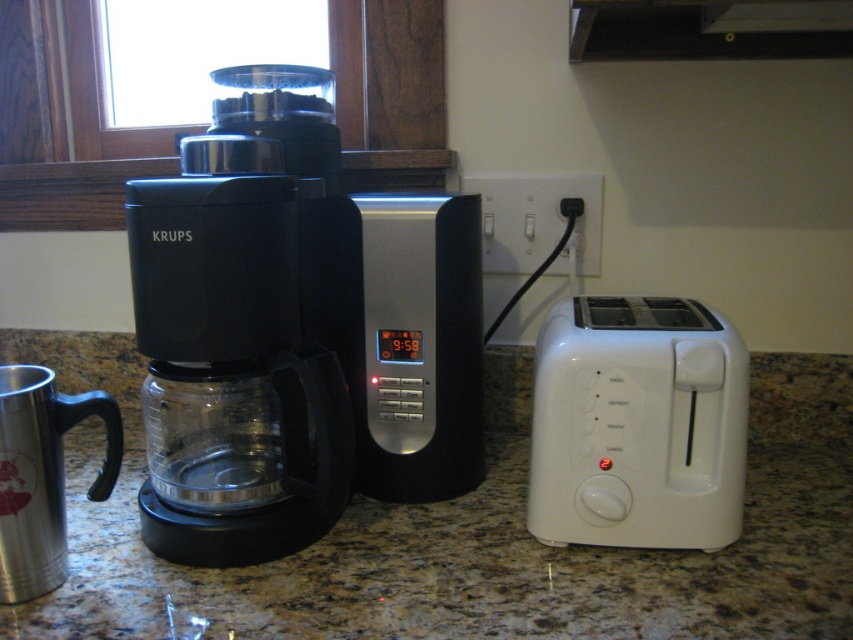
Between black plastic coffee maker at center and white plastic toaster at right, which one has less height?

white plastic toaster at right

Is black plastic coffee maker at center wider than white plastic toaster at right?

Yes.

Between point (236, 80) and point (708, 496), which one is positioned behind?

The point (236, 80) is more distant.

The image size is (853, 640). I want to click on black plastic coffee maker at center, so click(244, 326).

Who is taller, granite at center or white plastic toaster at right?

With more height is white plastic toaster at right.

Is point (96, 621) positioned after point (541, 538)?

No, (96, 621) is closer to viewer.

Find the location of a particular element. The height and width of the screenshot is (640, 853). granite at center is located at coordinates (468, 536).

Can you confirm if black plastic coffee maker at center is wider than silver metallic digital clock at center?

Yes.

Looking at this image, who is more distant from viewer, (228, 340) or (426, 396)?

The point (426, 396) is more distant.

The width and height of the screenshot is (853, 640). Describe the element at coordinates (244, 326) in the screenshot. I see `black plastic coffee maker at center` at that location.

Image resolution: width=853 pixels, height=640 pixels. Identify the location of black plastic coffee maker at center. (244, 326).